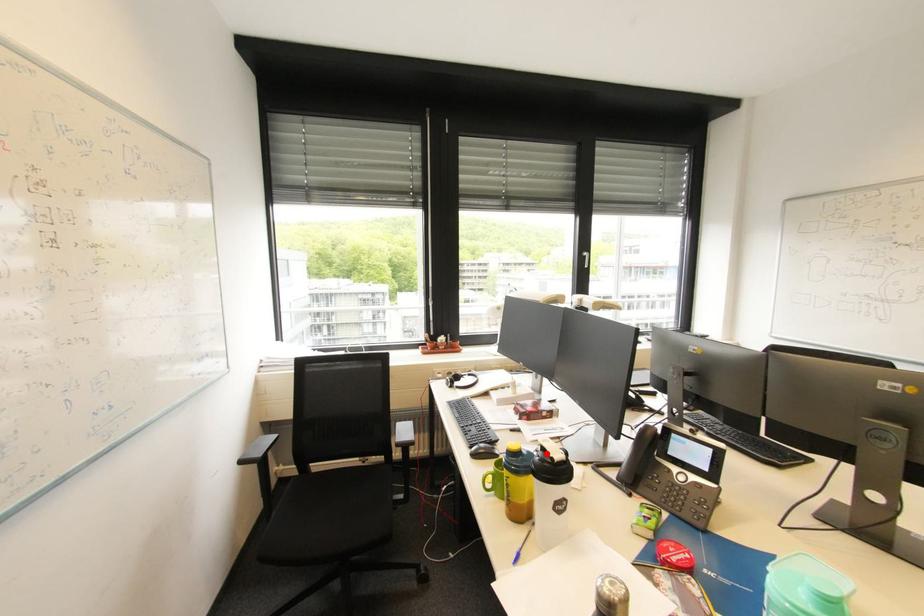
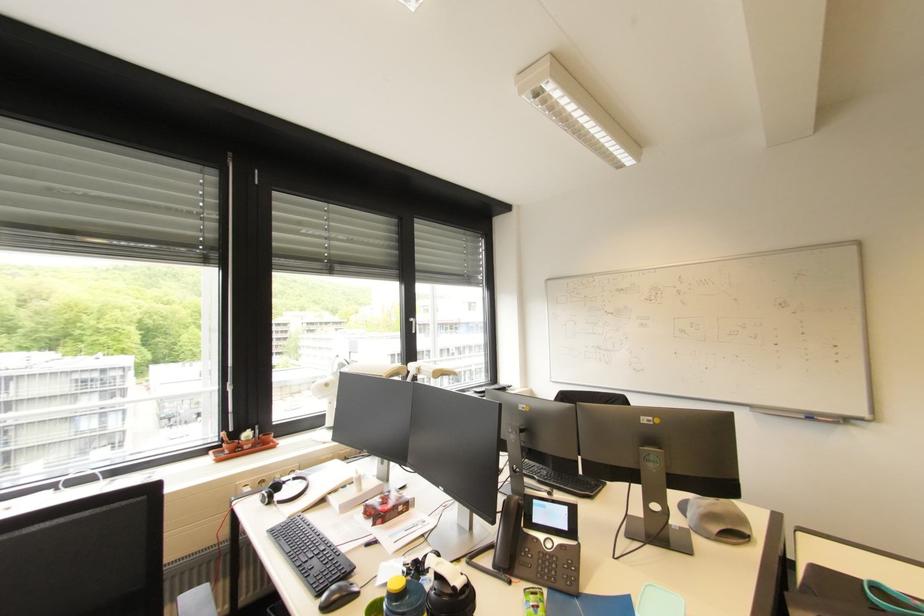
Question: A red point is marked in image1. In image2, is the corresponding 3D point closer to the camera or farther? Reply with the corresponding letter.

Choices:
 (A) The corresponding 3D point is closer.
 (B) The corresponding 3D point is farther.

Answer: (B)